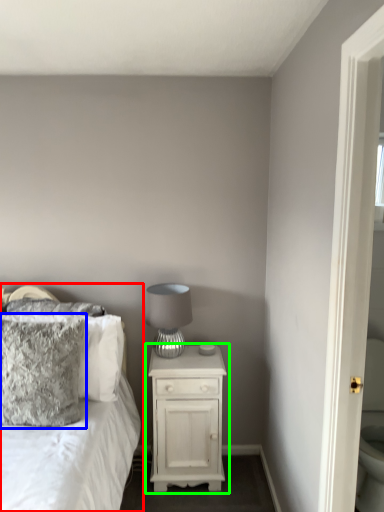
Question: Which is nearer to the bed (highlighted by a red box)? pillow (highlighted by a blue box) or nightstand (highlighted by a green box).

Choices:
 (A) pillow
 (B) nightstand

Answer: (A)